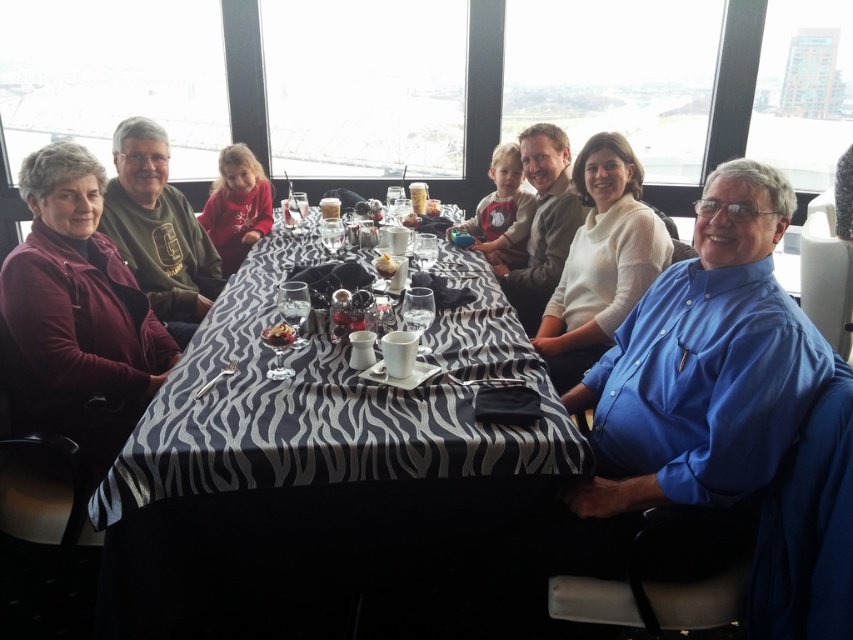
Is matte brown pastry at center taller than white crumbly cake at center?

Incorrect, matte brown pastry at center's height is not larger of white crumbly cake at center's.

Which is more to the right, matte brown pastry at center or white crumbly cake at center?

white crumbly cake at center

The height and width of the screenshot is (640, 853). In order to click on matte brown pastry at center in this screenshot , I will do `click(277, 336)`.

Is point (274, 339) farther from viewer compared to point (416, 216)?

No, (274, 339) is in front of (416, 216).

I want to click on matte brown pastry at center, so click(277, 336).

Where is `matte brown pastry at center`? matte brown pastry at center is located at coordinates (277, 336).

Who is taller, zebra-patterned tablecloth at center or matte brown pastry at center?

zebra-patterned tablecloth at center

Does zebra-patterned tablecloth at center appear on the left side of matte brown pastry at center?

In fact, zebra-patterned tablecloth at center is to the right of matte brown pastry at center.

I want to click on zebra-patterned tablecloth at center, so click(x=315, y=460).